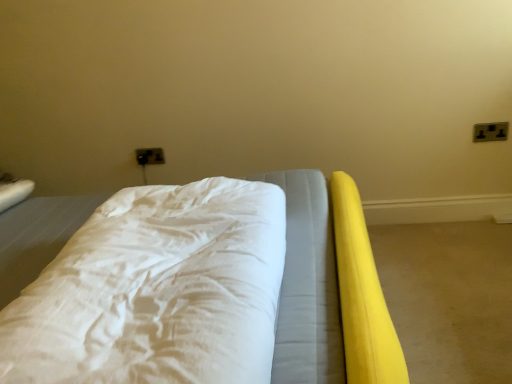
Question: Should I look upward or downward to see white soft bed at center?

Choices:
 (A) up
 (B) down

Answer: (B)

Question: Considering the relative positions of white soft bed at center and yellow rubber mat at right in the image provided, is white soft bed at center to the right of yellow rubber mat at right from the viewer's perspective?

Choices:
 (A) yes
 (B) no

Answer: (B)

Question: From a real-world perspective, is white soft bed at center below yellow rubber mat at right?

Choices:
 (A) yes
 (B) no

Answer: (B)

Question: Is white soft bed at center facing away from yellow rubber mat at right?

Choices:
 (A) yes
 (B) no

Answer: (B)

Question: From the image's perspective, does white soft bed at center appear higher than yellow rubber mat at right?

Choices:
 (A) yes
 (B) no

Answer: (A)

Question: Is yellow rubber mat at right inside white soft bed at center?

Choices:
 (A) yes
 (B) no

Answer: (B)

Question: Is white soft bed at center taller than yellow rubber mat at right?

Choices:
 (A) yes
 (B) no

Answer: (A)

Question: Is matte plastic outlet at upper center, which appears as the second electric outlet when viewed from the right, next to yellow rubber mat at right?

Choices:
 (A) yes
 (B) no

Answer: (B)

Question: From a real-world perspective, is matte plastic outlet at upper center, which appears as the second electric outlet when viewed from the right, beneath yellow rubber mat at right?

Choices:
 (A) no
 (B) yes

Answer: (A)

Question: Does matte plastic outlet at upper center, which appears as the second electric outlet when viewed from the right, have a lesser width compared to yellow rubber mat at right?

Choices:
 (A) no
 (B) yes

Answer: (B)

Question: Is matte plastic outlet at upper center, arranged as the second electric outlet when viewed from the front, far away from yellow rubber mat at right?

Choices:
 (A) no
 (B) yes

Answer: (B)

Question: Is matte plastic outlet at upper center, which ranks as the second electric outlet in top-to-bottom order, oriented towards yellow rubber mat at right?

Choices:
 (A) no
 (B) yes

Answer: (A)

Question: Is matte plastic outlet at upper center, the first electric outlet in the bottom-to-top sequence, at the right side of yellow rubber mat at right?

Choices:
 (A) yes
 (B) no

Answer: (B)

Question: Is white soft bed at center bigger than matte plastic outlet at upper center, positioned as the 1th electric outlet in back-to-front order?

Choices:
 (A) no
 (B) yes

Answer: (B)